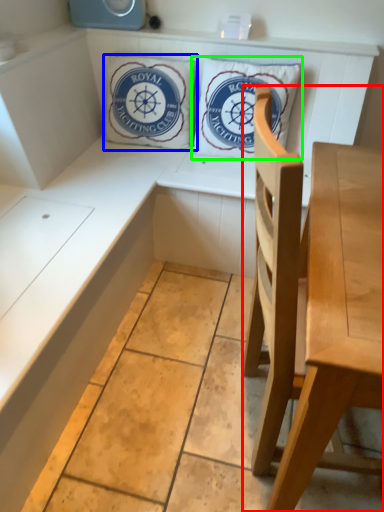
Question: Estimate the real-world distances between objects in this image. Which object is closer to chair (highlighted by a red box), pillow (highlighted by a blue box) or pillow (highlighted by a green box)?

Choices:
 (A) pillow
 (B) pillow

Answer: (B)